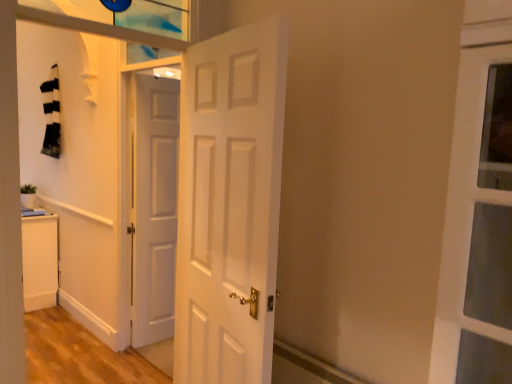
Question: From a real-world perspective, is white matte cabinet at lower left above or below green matte plant at lower left?

Choices:
 (A) below
 (B) above

Answer: (A)

Question: Looking at the image, does white matte cabinet at lower left seem bigger or smaller compared to green matte plant at lower left?

Choices:
 (A) big
 (B) small

Answer: (A)

Question: Which of these objects is positioned closest to the white matte door at center, the second door in the left-to-right sequence?

Choices:
 (A) white matte cabinet at lower left
 (B) white matte door at center, which appears as the 1th door when viewed from the back
 (C) green matte plant at lower left

Answer: (B)

Question: Which object is positioned farthest from the green matte plant at lower left?

Choices:
 (A) white matte door at center, which is counted as the 1th door, starting from the front
 (B) white matte cabinet at lower left
 (C) white matte door at center, which appears as the 1th door when viewed from the back

Answer: (A)